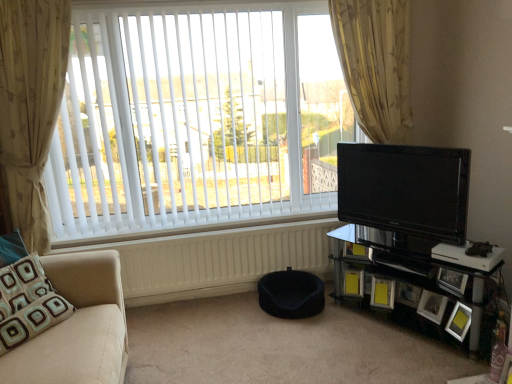
This screenshot has width=512, height=384. I want to click on vacant region to the left of yellow paper at lower right, the 2th picture frame when ordered from left to right, so click(x=361, y=306).